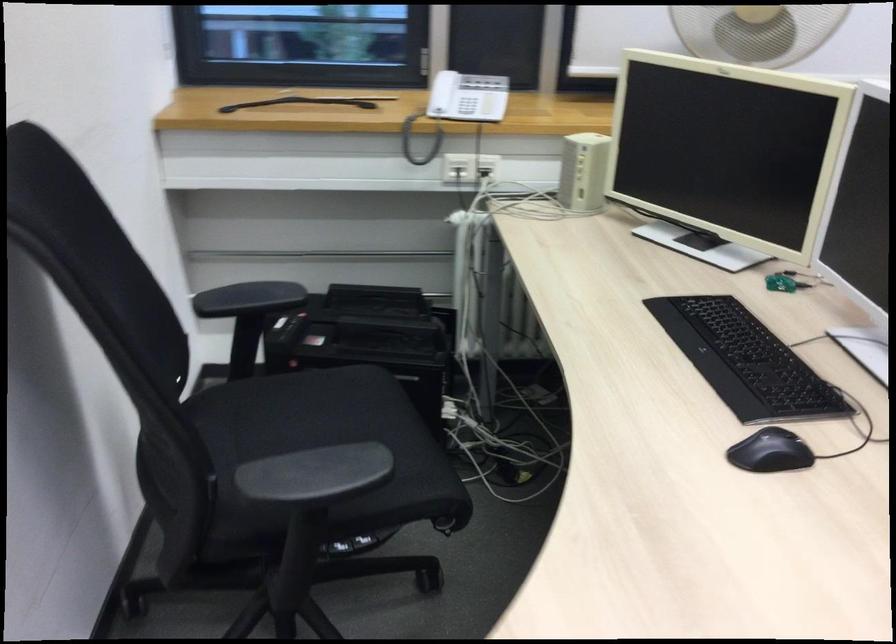
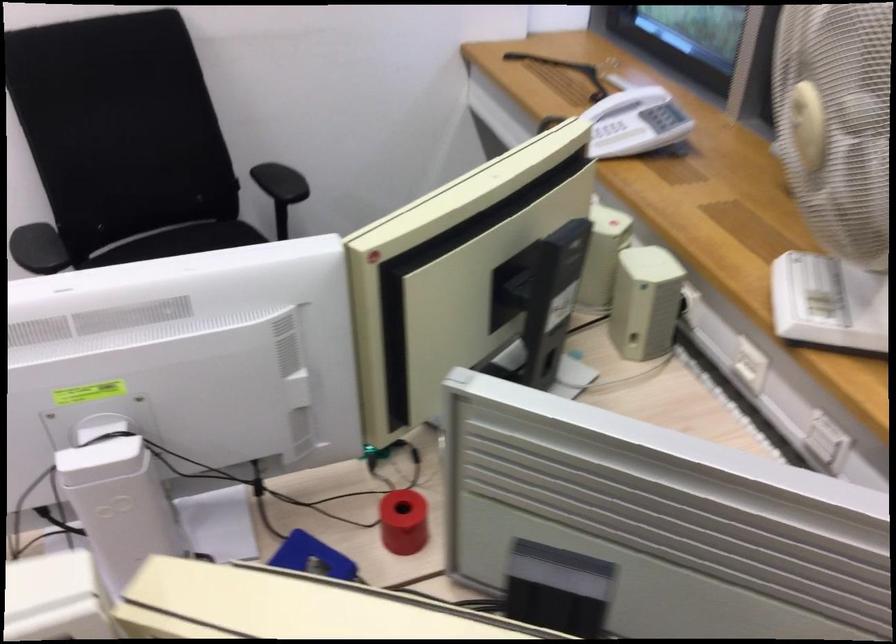
Find the pixel in the second image that matches point (445, 87) in the first image.

(634, 122)